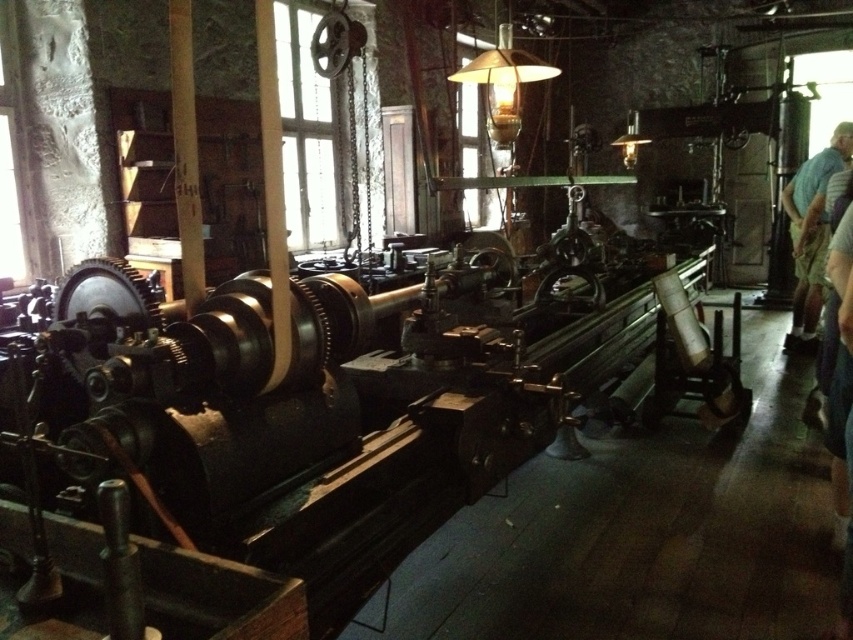
Between blue shirt at right and matte glass lampshade at upper center, which one appears on the left side from the viewer's perspective?

matte glass lampshade at upper center

Which is in front, point (828, 160) or point (480, 56)?

Point (480, 56)

Is point (819, 250) more distant than point (511, 24)?

No, (819, 250) is in front of (511, 24).

Where is `blue shirt at right`? blue shirt at right is located at coordinates (811, 228).